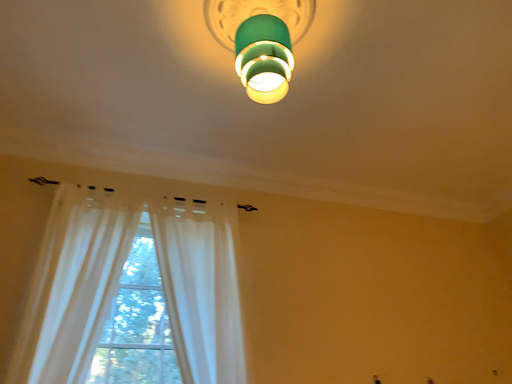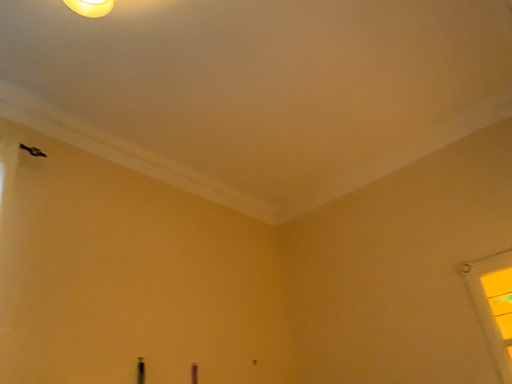
Question: Which way did the camera rotate in the video?

Choices:
 (A) rotated right
 (B) rotated left

Answer: (A)